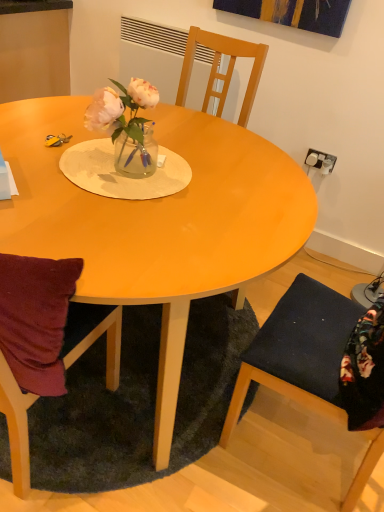
This screenshot has width=384, height=512. I want to click on vacant region to the left of translucent glass vase at center, so click(66, 157).